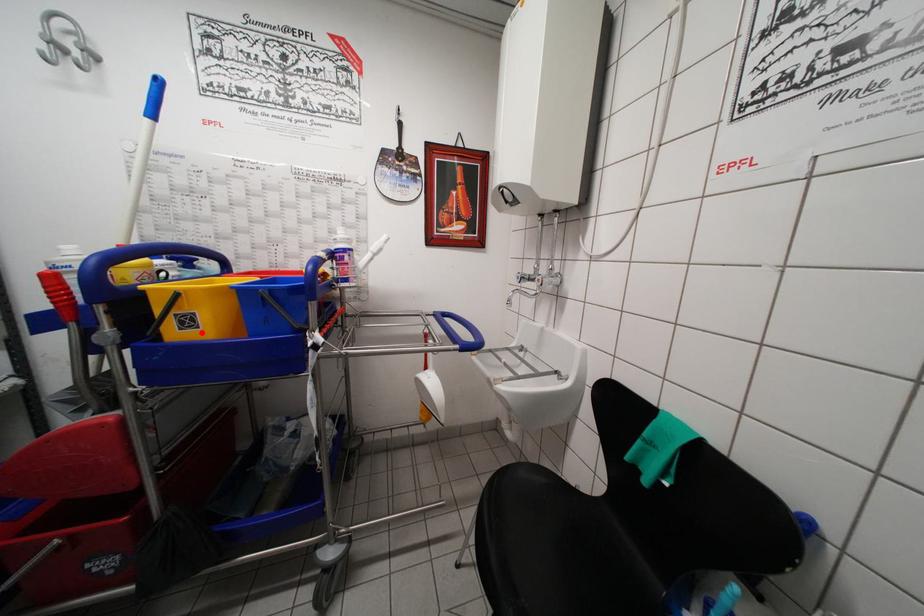
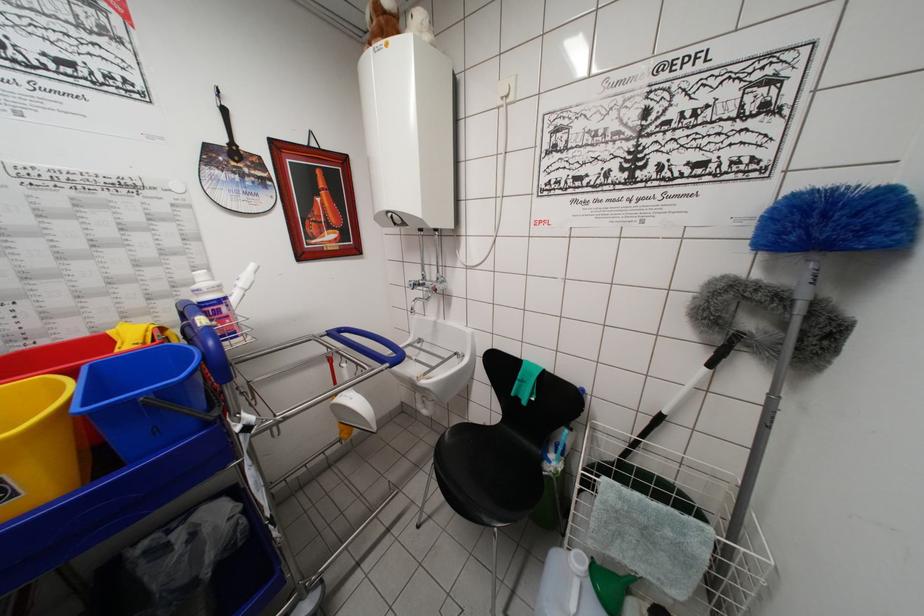
In the second image, find the point that corresponds to the highlighted location in the first image.

(20, 500)